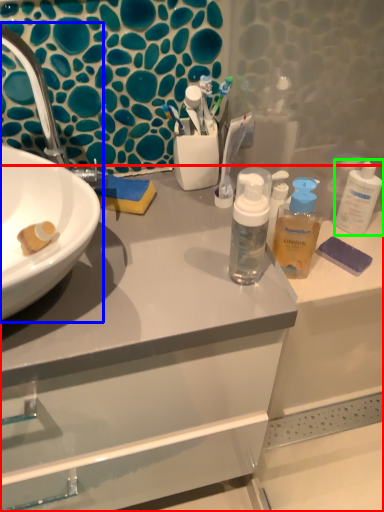
Question: Considering the real-world distances, which object is farthest from bathroom cabinet (highlighted by a red box)? sink (highlighted by a blue box) or cleaning product (highlighted by a green box)?

Choices:
 (A) sink
 (B) cleaning product

Answer: (B)